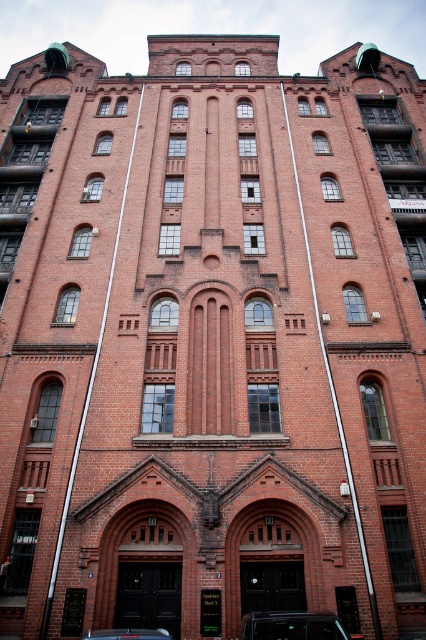
You are standing in front of the building and want to park your car in the closest available spot. The parking spots are marked at coordinates ranging from 0.0 to 1.0 in both x and y directions. Where should you park your car to be closest to the shiny black car at lower center?

The closest parking spot would be near the coordinates provided for the shiny black car at lower center, which is at point (291,625). Therefore, you should park your car near those coordinates to be closest to the shiny black car at lower center.